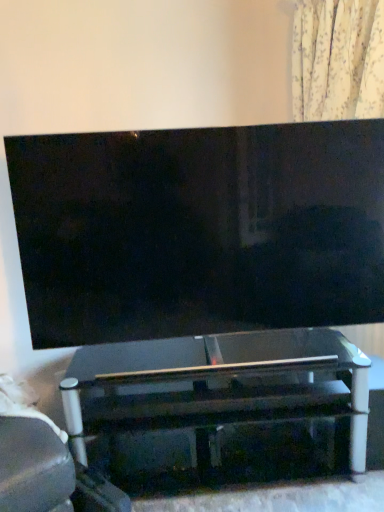
Question: From a real-world perspective, is matte black tv at center physically located above or below transparent glass table at center?

Choices:
 (A) below
 (B) above

Answer: (B)

Question: From their relative heights in the image, would you say matte black tv at center is taller or shorter than transparent glass table at center?

Choices:
 (A) short
 (B) tall

Answer: (B)

Question: Considering their positions, is matte black tv at center located in front of or behind transparent glass table at center?

Choices:
 (A) front
 (B) behind

Answer: (A)

Question: Is point coord(216,407) closer or farther from the camera than point coord(279,176)?

Choices:
 (A) farther
 (B) closer

Answer: (A)

Question: Looking at their shapes, would you say transparent glass table at center is wider or thinner than matte black tv at center?

Choices:
 (A) wide
 (B) thin

Answer: (A)

Question: From a real-world perspective, relative to matte black tv at center, is transparent glass table at center vertically above or below?

Choices:
 (A) above
 (B) below

Answer: (B)

Question: Is transparent glass table at center spatially inside matte black tv at center, or outside of it?

Choices:
 (A) inside
 (B) outside

Answer: (B)